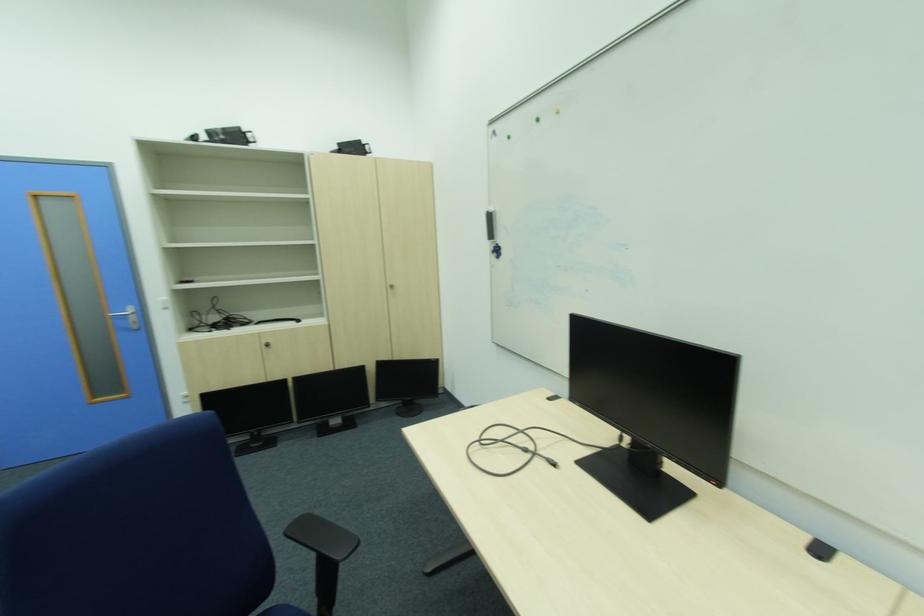
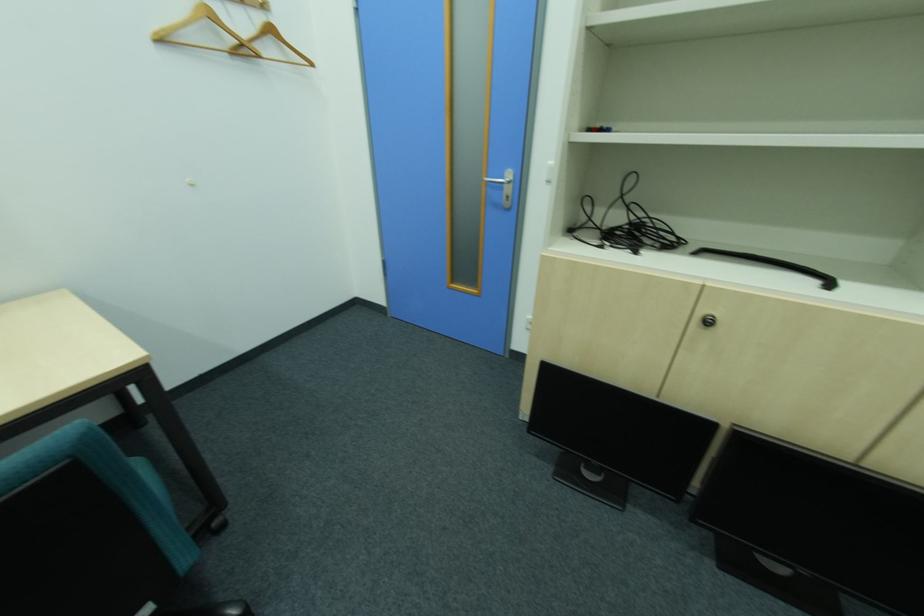
Locate, in the second image, the point that corresponds to point (136, 310) in the first image.

(513, 177)